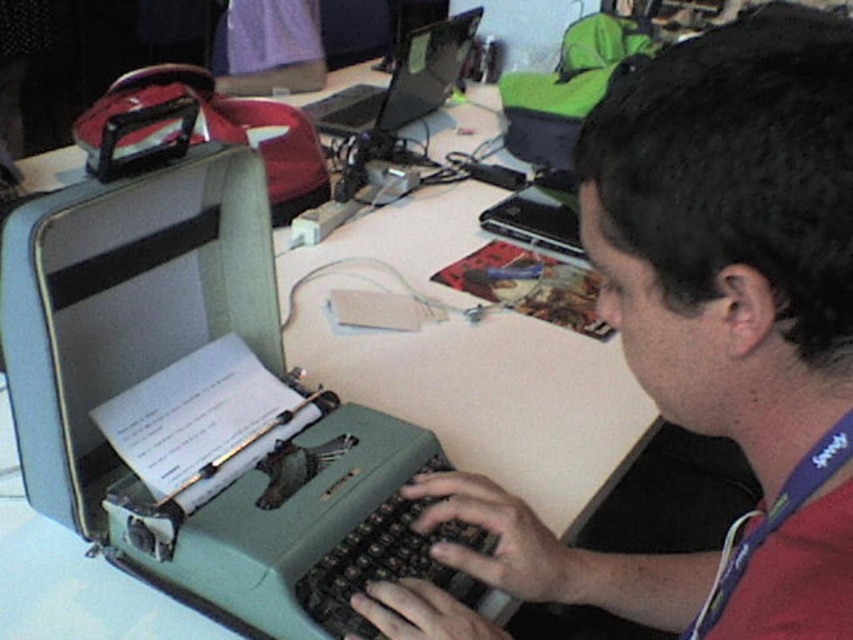
You are organizing a desk for a writer who needs to place both the matte green typewriter at center and the black glossy laptop at upper center. According to the image, which object should be placed to the right of the other?

The matte green typewriter at center is to the right of the black glossy laptop at upper center, so the typewriter should be placed to the right of the laptop.

You are organizing a desk space and need to determine which item takes up more physical space. Based on the scene, which object is larger between the matte green typewriter at center and the black glossy laptop at upper center?

The black glossy laptop at upper center is larger than the matte green typewriter at center.

You are a delivery robot with a package that is 16 inches long. You need to place it on either the white plastic table at center or the black glossy laptop at upper center. Which surface can accommodate the package without it overhanging?

The white plastic table at center and black glossy laptop at upper center are 15.18 inches apart from each other. Neither surface can accommodate the 16 inch package as both are smaller than the package length.